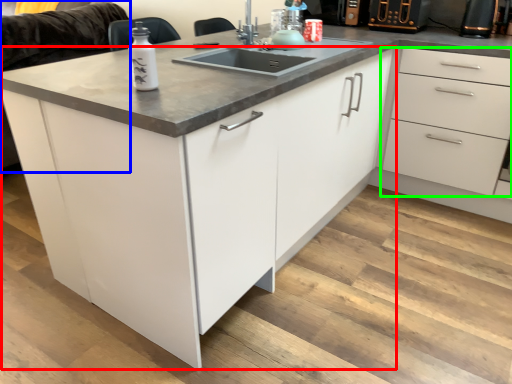
Question: Which object is positioned farthest from cabinetry (highlighted by a red box)? Select from couch (highlighted by a blue box) and drawer (highlighted by a green box).

Choices:
 (A) couch
 (B) drawer

Answer: (A)